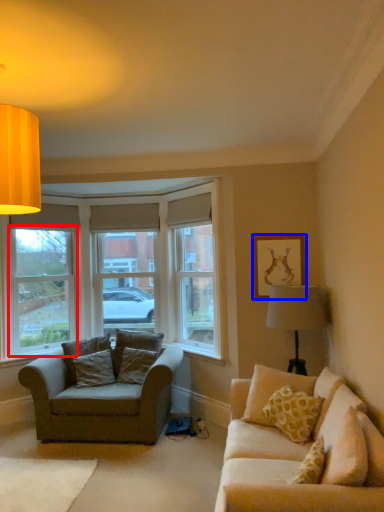
Question: Which object is further to the camera taking this photo, window frame (highlighted by a red box) or picture frame (highlighted by a blue box)?

Choices:
 (A) window frame
 (B) picture frame

Answer: (A)